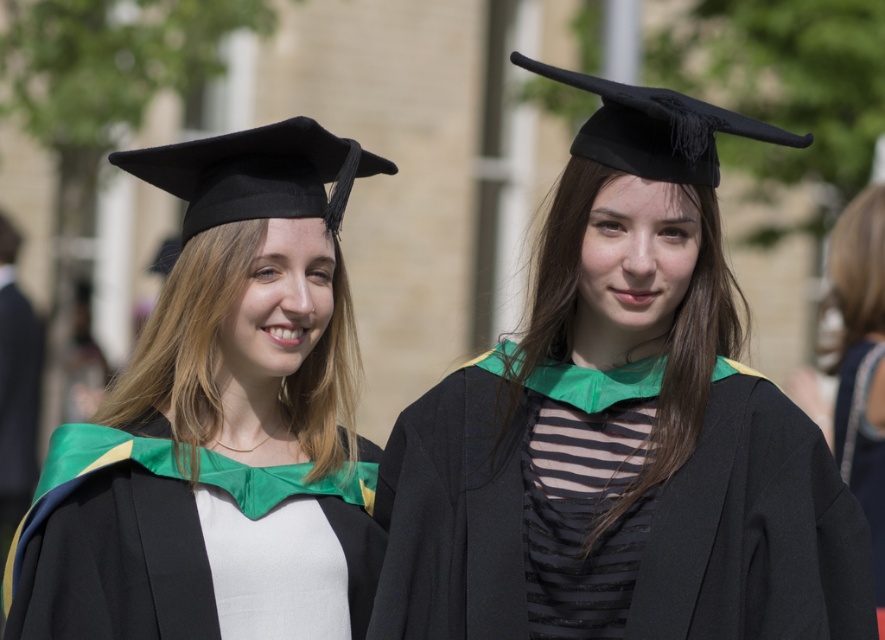
Question: Is the position of matte black graduation cap at center less distant than that of black satin graduation gown at right?

Choices:
 (A) yes
 (B) no

Answer: (A)

Question: Which point is closer to the camera?

Choices:
 (A) satin black graduation cap at left
 (B) black satin graduation gown at right

Answer: (A)

Question: Which point appears farthest from the camera in this image?

Choices:
 (A) (276, 179)
 (B) (632, 173)
 (C) (118, 589)

Answer: (A)

Question: Which point appears farthest from the camera in this image?

Choices:
 (A) (231, 545)
 (B) (509, 620)

Answer: (A)

Question: Is satin black graduation cap at left bigger than black matte graduation cap at left?

Choices:
 (A) yes
 (B) no

Answer: (A)

Question: Can you confirm if satin black graduation cap at left is thinner than satin green graduation gown at center?

Choices:
 (A) no
 (B) yes

Answer: (A)